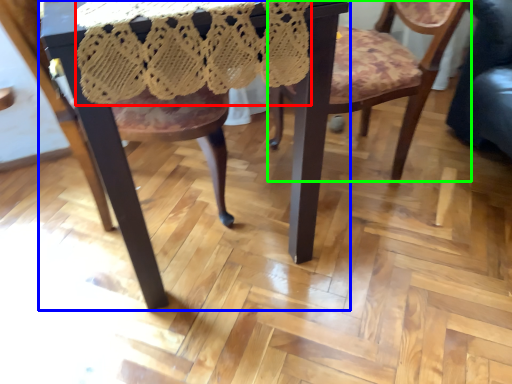
Question: Considering the real-world distances, which object is farthest from lace dress (highlighted by a red box)? table (highlighted by a blue box) or chair (highlighted by a green box)?

Choices:
 (A) table
 (B) chair

Answer: (B)